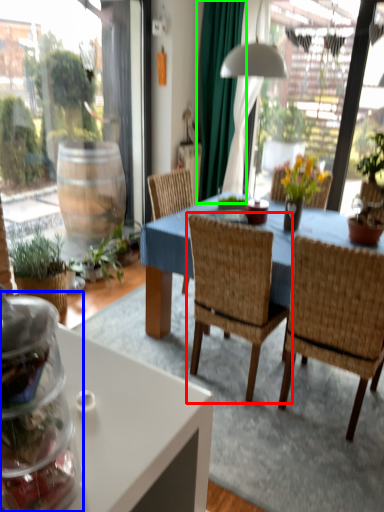
Question: Based on their relative distances, which object is nearer to chair (highlighted by a red box)? Choose from glass jar (highlighted by a blue box) and curtain (highlighted by a green box).

Choices:
 (A) glass jar
 (B) curtain

Answer: (A)